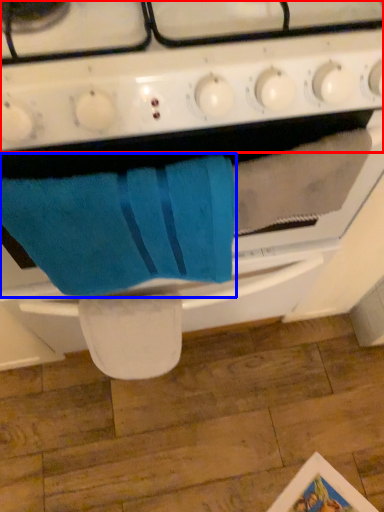
Question: Which point is closer to the camera, gas stove (highlighted by a red box) or bath towel (highlighted by a blue box)?

Choices:
 (A) gas stove
 (B) bath towel

Answer: (A)